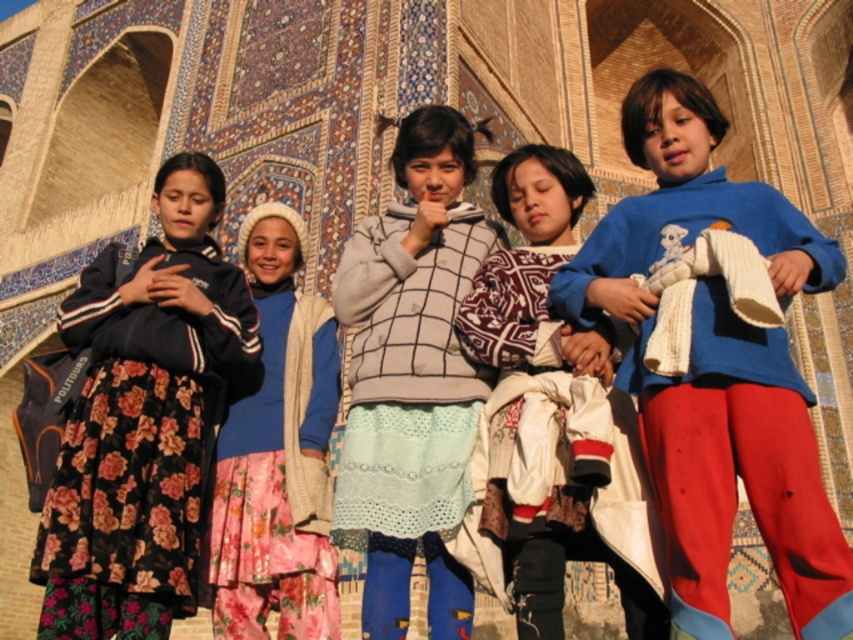
Question: Is blue cotton sweater at center to the right of light gray knitted sweater at center from the viewer's perspective?

Choices:
 (A) no
 (B) yes

Answer: (B)

Question: Does knitted sweater at center appear on the right side of light gray knitted sweater at center?

Choices:
 (A) yes
 (B) no

Answer: (A)

Question: Which object is closer to the camera taking this photo?

Choices:
 (A) light gray knitted sweater at center
 (B) blue cotton sweater at center
 (C) blue soft sweater at center
 (D) knitted sweater at center

Answer: (B)

Question: Which object is closer to the camera taking this photo?

Choices:
 (A) blue cotton sweater at center
 (B) light gray knitted sweater at center

Answer: (A)

Question: Does knitted sweater at center have a greater width compared to light gray knitted sweater at center?

Choices:
 (A) yes
 (B) no

Answer: (B)

Question: Which point is farther from the camera taking this photo?

Choices:
 (A) (445, 273)
 (B) (306, 612)
 (C) (480, 308)

Answer: (A)